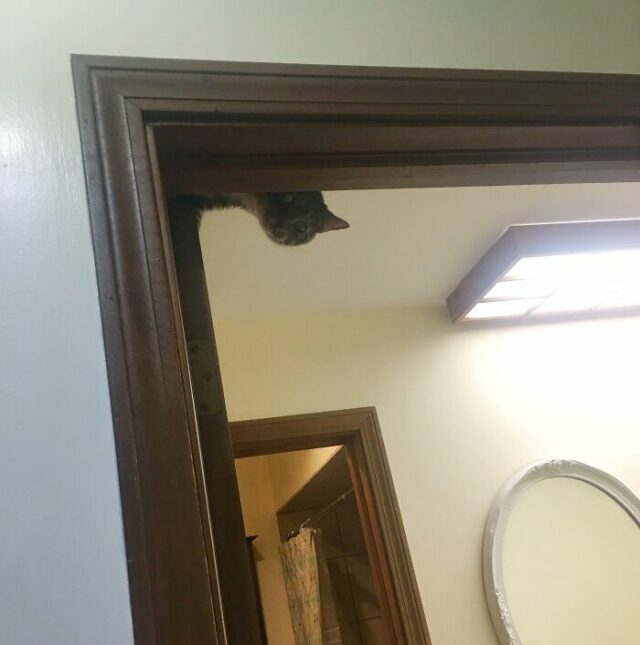
Locate an element on the screen. decorative areas on mirror frame is located at coordinates (556, 462), (500, 604).